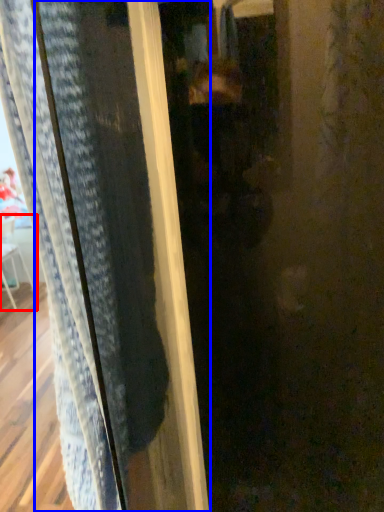
Question: Which object is closer to the camera taking this photo, armchair (highlighted by a red box) or screen door (highlighted by a blue box)?

Choices:
 (A) armchair
 (B) screen door

Answer: (B)